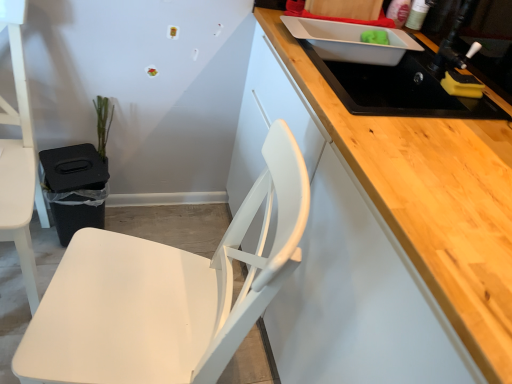
Question: From the image's perspective, relative to black matte sink at upper right, is green matte plant at left above or below?

Choices:
 (A) above
 (B) below

Answer: (B)

Question: Is green matte plant at left situated inside black matte sink at upper right or outside?

Choices:
 (A) outside
 (B) inside

Answer: (A)

Question: Considering the real-world distances, which object is closest to the green matte plant at left?

Choices:
 (A) white matte chair at left, marked as the 1th chair in a left-to-right arrangement
 (B) black matte sink at upper right
 (C) white matte chair at lower left, the 2th chair in the left-to-right sequence

Answer: (A)

Question: Which is nearer to the white matte chair at lower left, the 2th chair in the left-to-right sequence?

Choices:
 (A) white matte chair at left, positioned as the second chair in right-to-left order
 (B) black matte sink at upper right
 (C) green matte plant at left

Answer: (A)